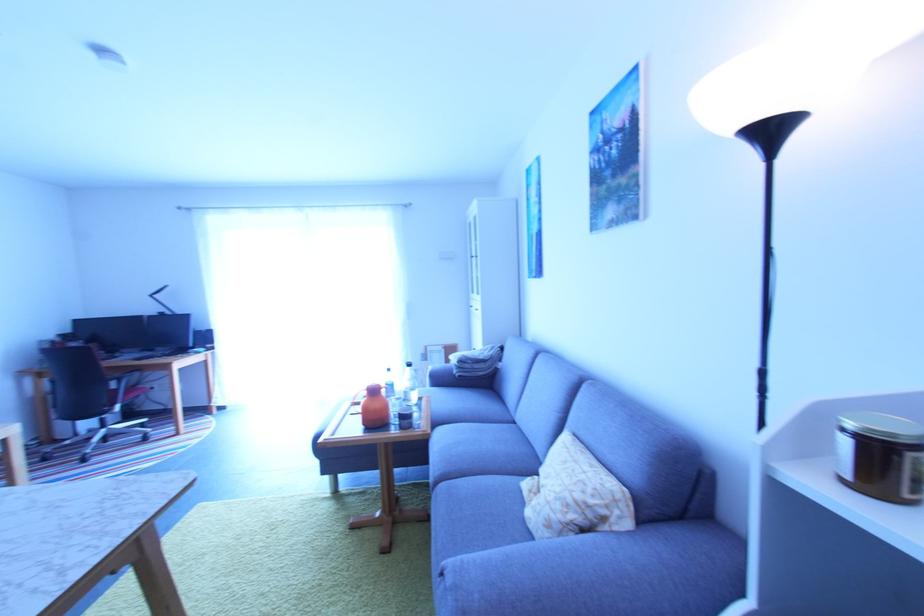
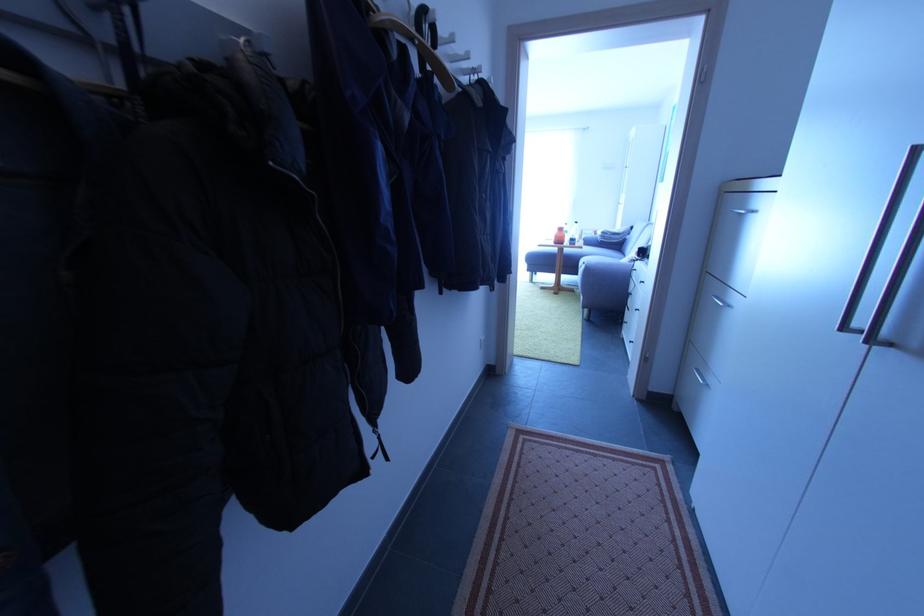
Where in the second image is the point corresponding to [430,359] from the first image?

(585, 238)